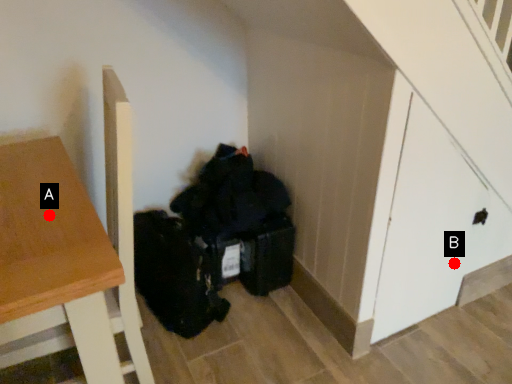
Question: Two points are circled on the image, labeled by A and B beside each circle. Which point is farther to the camera?

Choices:
 (A) A is further
 (B) B is further

Answer: (B)